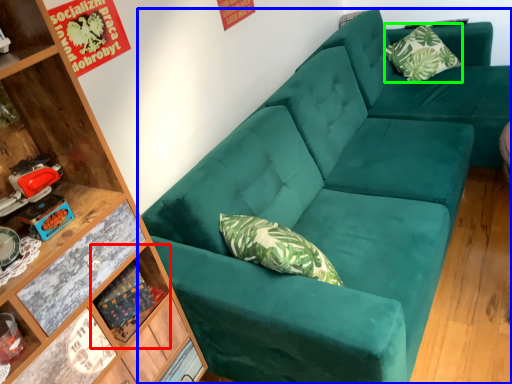
Question: Estimate the real-world distances between objects in this image. Which object is farther from shelf (highlighted by a red box), studio couch (highlighted by a blue box) or pillow (highlighted by a green box)?

Choices:
 (A) studio couch
 (B) pillow

Answer: (B)